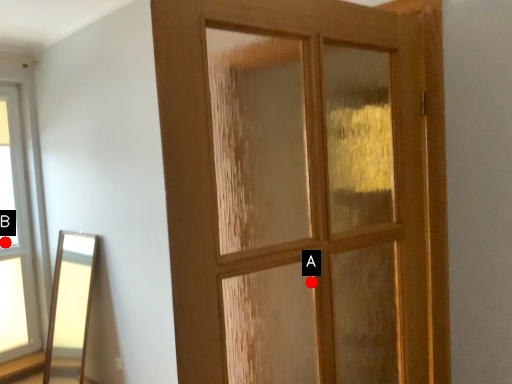
Question: Two points are circled on the image, labeled by A and B beside each circle. Which point is closer to the camera?

Choices:
 (A) A is closer
 (B) B is closer

Answer: (A)